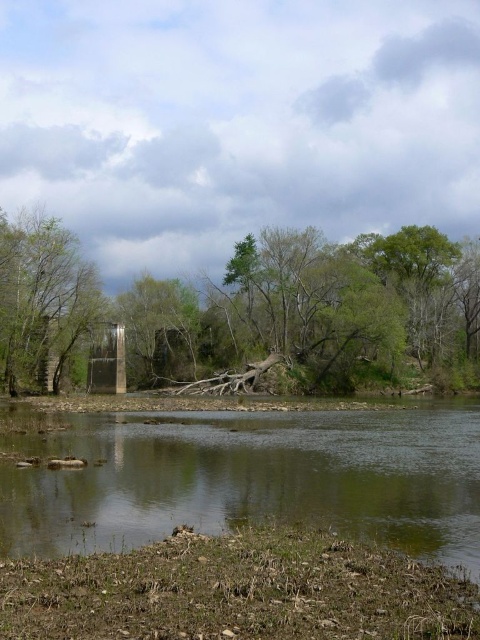
Between green reflective water at center and brown rough tree at center, which one is positioned higher?

brown rough tree at center is higher up.

Between green reflective water at center and brown rough tree at center, which one appears on the left side from the viewer's perspective?

Positioned to the left is brown rough tree at center.

Is point (477, 474) behind point (101, 291)?

That is False.

This screenshot has width=480, height=640. Identify the location of green reflective water at center. (252, 477).

The height and width of the screenshot is (640, 480). Describe the element at coordinates (252, 477) in the screenshot. I see `green reflective water at center` at that location.

Does point (383, 476) come in front of point (54, 262)?

Yes, point (383, 476) is closer to viewer.

Find the location of a particular element. The image size is (480, 640). green reflective water at center is located at coordinates (252, 477).

Does brown rough tree at center have a larger size compared to green matte tree at left?

Correct, brown rough tree at center is larger in size than green matte tree at left.

Does brown rough tree at center appear on the right side of green matte tree at left?

Indeed, brown rough tree at center is positioned on the right side of green matte tree at left.

Identify the location of brown rough tree at center. (245, 305).

Locate an element on the screen. Image resolution: width=480 pixels, height=640 pixels. brown rough tree at center is located at coordinates (245, 305).